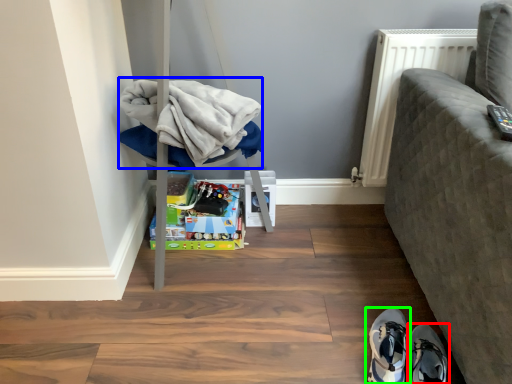
Question: Which object is positioned closest to footwear (highlighted by a red box)? Select from clothing (highlighted by a blue box) and footwear (highlighted by a green box).

Choices:
 (A) clothing
 (B) footwear

Answer: (B)